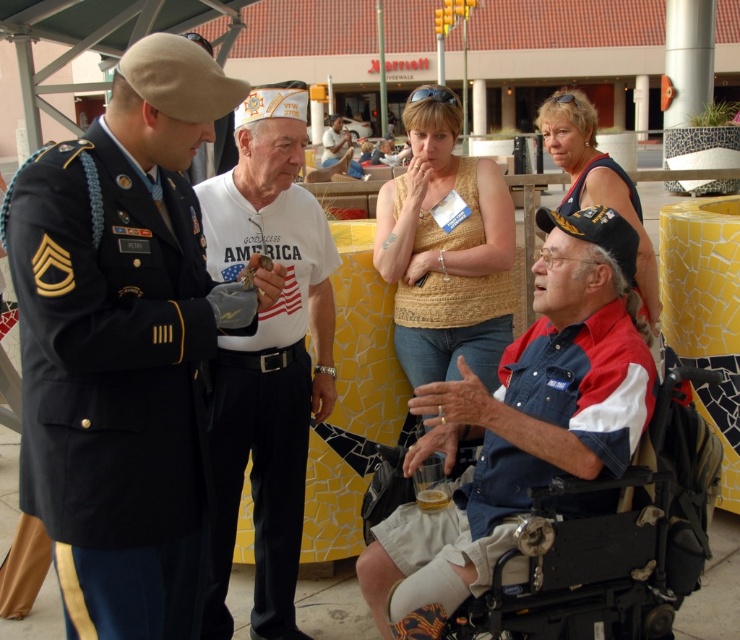
Is blue denim shirt at upper center wider than white matte t-shirt at center?

Yes.

Looking at this image, measure the distance between blue denim shirt at upper center and white matte t-shirt at center.

20.36 meters

The height and width of the screenshot is (640, 740). Find the location of `blue denim shirt at upper center`. blue denim shirt at upper center is located at coordinates (596, 180).

Is black plastic wheelchair at lower right thinner than white matte t-shirt at center?

No, black plastic wheelchair at lower right is not thinner than white matte t-shirt at center.

Between point (630, 492) and point (334, 125), which one is positioned behind?

The point (334, 125) is behind.

Between point (619, 573) and point (329, 156), which one is positioned in front?

Point (619, 573) is more forward.

Identify the location of black plastic wheelchair at lower right. This screenshot has width=740, height=640. (612, 538).

Measure the distance between point (576, 224) and camera.

Point (576, 224) and camera are 8.67 feet apart.

Is denim shirt at lower right positioned before beige textured tank top at center?

Yes, denim shirt at lower right is in front of beige textured tank top at center.

Is point (531, 362) positioned after point (433, 365)?

No, (531, 362) is closer to viewer.

Find the location of a particular element. The image size is (740, 640). denim shirt at lower right is located at coordinates pos(519,424).